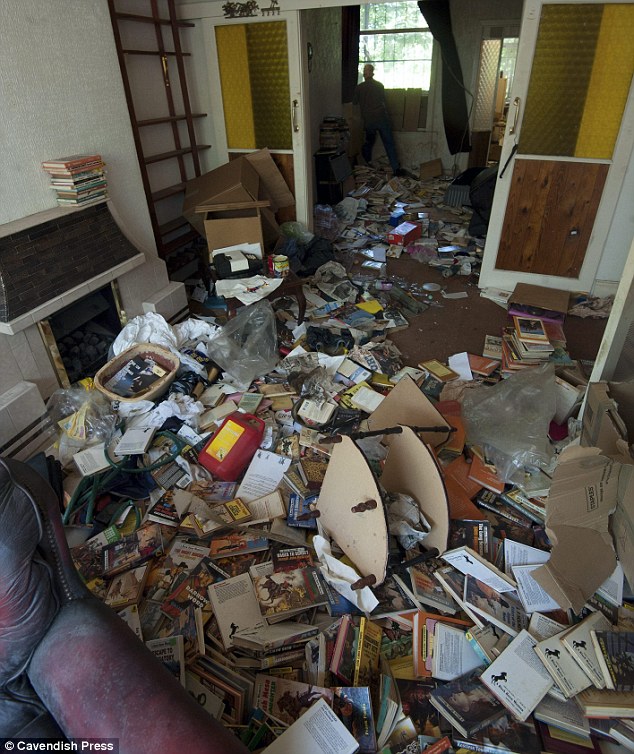
Identify the location of wallpaper. (44, 117).